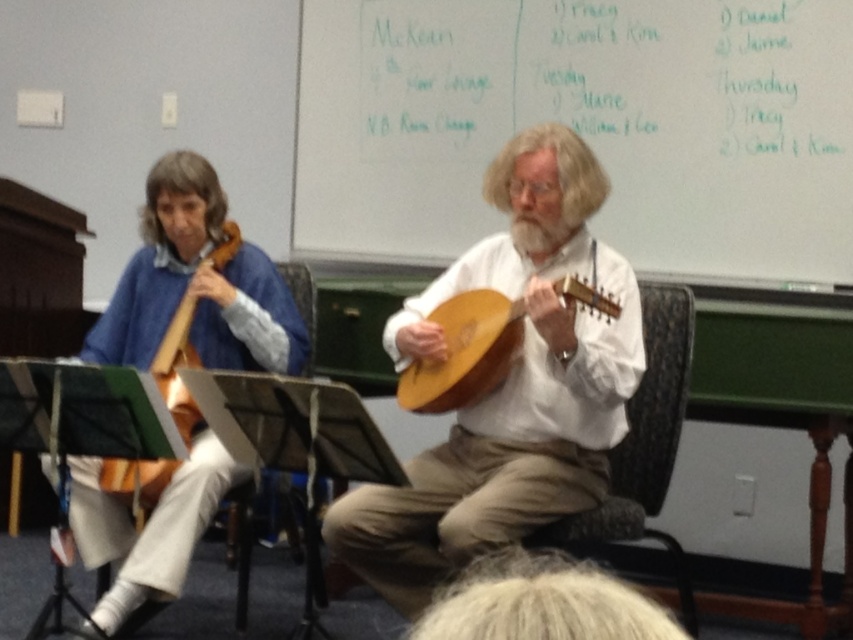
Can you confirm if wooden at left is shorter than brown fabric chair at center?

Incorrect, wooden at left's height does not fall short of brown fabric chair at center's.

The image size is (853, 640). What are the coordinates of `wooden at left` in the screenshot? It's located at (202, 314).

Find the location of a particular element. This screenshot has height=640, width=853. wooden at left is located at coordinates (202, 314).

Can you confirm if whiteboard at upper center is wider than wooden acoustic guitar at center?

Yes.

Does whiteboard at upper center have a lesser height compared to wooden acoustic guitar at center?

No.

Is point (399, 102) more distant than point (582, 289)?

Yes.

At what (x,y) coordinates should I click in order to perform the action: click on whiteboard at upper center. Please return your answer as a coordinate pair (x, y). Looking at the image, I should click on (583, 125).

Is wooden at left to the right of wooden acoustic guitar at left from the viewer's perspective?

No, wooden at left is not to the right of wooden acoustic guitar at left.

This screenshot has width=853, height=640. I want to click on wooden at left, so click(x=202, y=314).